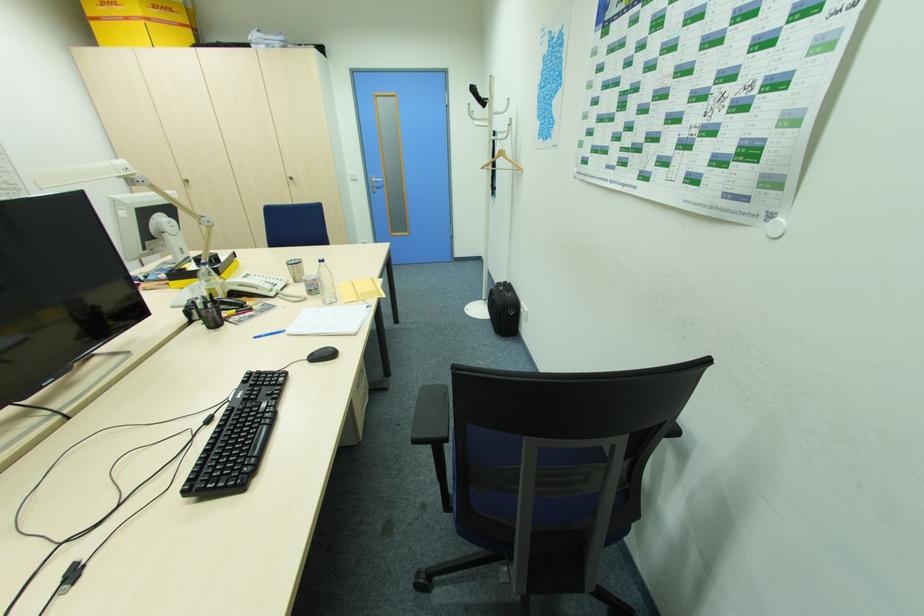
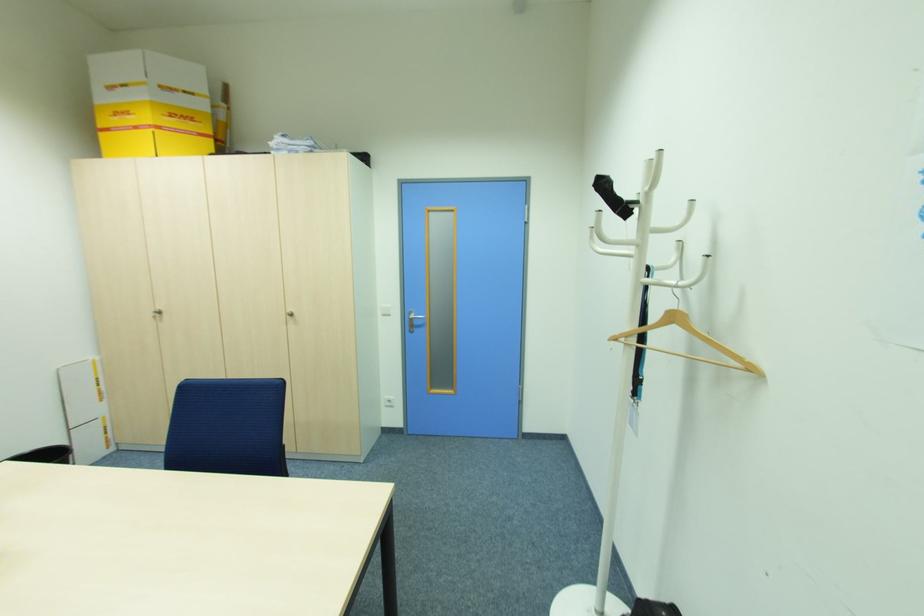
Find the pixel in the second image that matches point (523, 169) in the first image.

(756, 370)